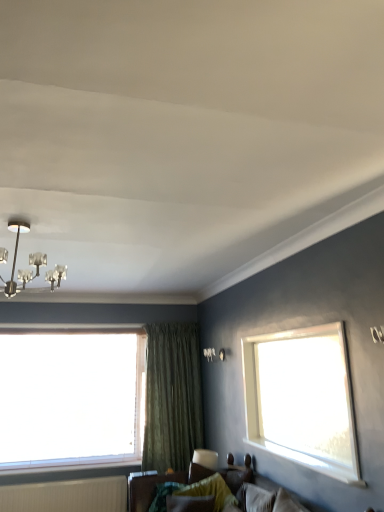
Question: From the image's perspective, is velvet green pillow at lower center located above textured fabric couch at lower center?

Choices:
 (A) no
 (B) yes

Answer: (A)

Question: From the image's perspective, is velvet green pillow at lower center located beneath textured fabric couch at lower center?

Choices:
 (A) yes
 (B) no

Answer: (A)

Question: Is velvet green pillow at lower center at the right side of textured fabric couch at lower center?

Choices:
 (A) yes
 (B) no

Answer: (B)

Question: Is textured fabric couch at lower center located within velvet green pillow at lower center?

Choices:
 (A) yes
 (B) no

Answer: (B)

Question: Is velvet green pillow at lower center closer to the viewer compared to textured fabric couch at lower center?

Choices:
 (A) no
 (B) yes

Answer: (A)

Question: Does velvet green pillow at lower center turn towards textured fabric couch at lower center?

Choices:
 (A) yes
 (B) no

Answer: (A)

Question: Does velvet green pillow at lower center have a greater width compared to green textured curtain at center?

Choices:
 (A) no
 (B) yes

Answer: (B)

Question: Would you say velvet green pillow at lower center is a long distance from green textured curtain at center?

Choices:
 (A) yes
 (B) no

Answer: (A)

Question: Is the position of velvet green pillow at lower center more distant than that of green textured curtain at center?

Choices:
 (A) yes
 (B) no

Answer: (B)

Question: Is velvet green pillow at lower center positioned with its back to green textured curtain at center?

Choices:
 (A) yes
 (B) no

Answer: (B)

Question: Can you confirm if velvet green pillow at lower center is thinner than green textured curtain at center?

Choices:
 (A) no
 (B) yes

Answer: (A)

Question: Is velvet green pillow at lower center positioned before green textured curtain at center?

Choices:
 (A) no
 (B) yes

Answer: (B)

Question: From the image's perspective, is velvet green pillow at lower center located above metallic chandelier at upper left?

Choices:
 (A) yes
 (B) no

Answer: (B)